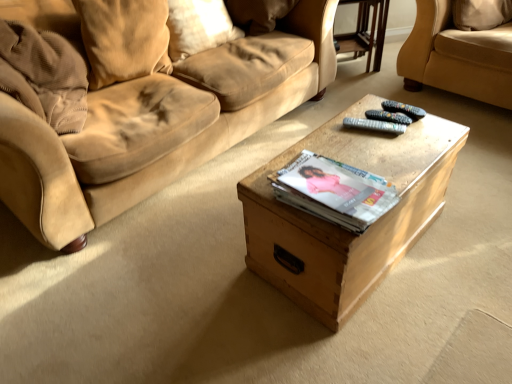
Where is `vacant area on the back side of matte paper magazine at center`? The width and height of the screenshot is (512, 384). vacant area on the back side of matte paper magazine at center is located at coordinates (342, 145).